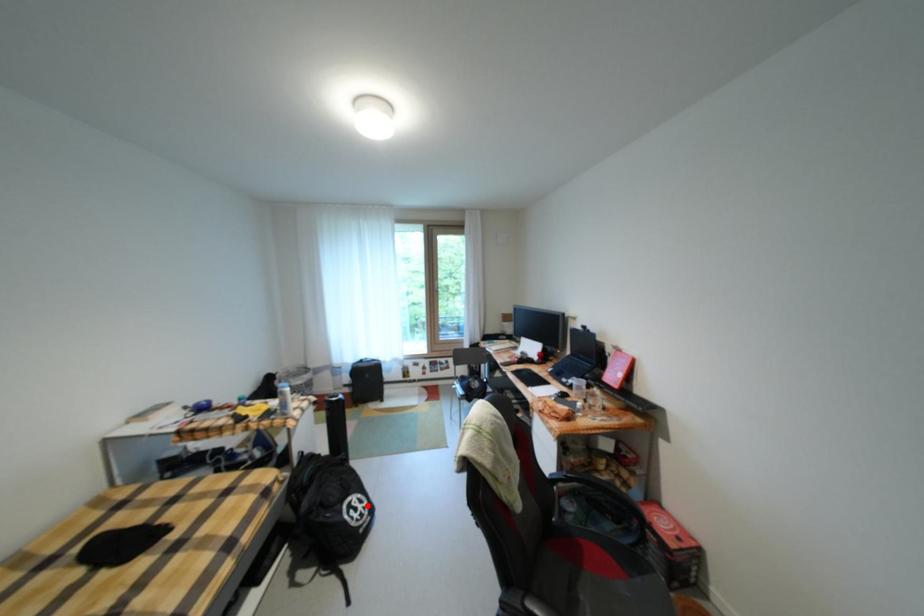
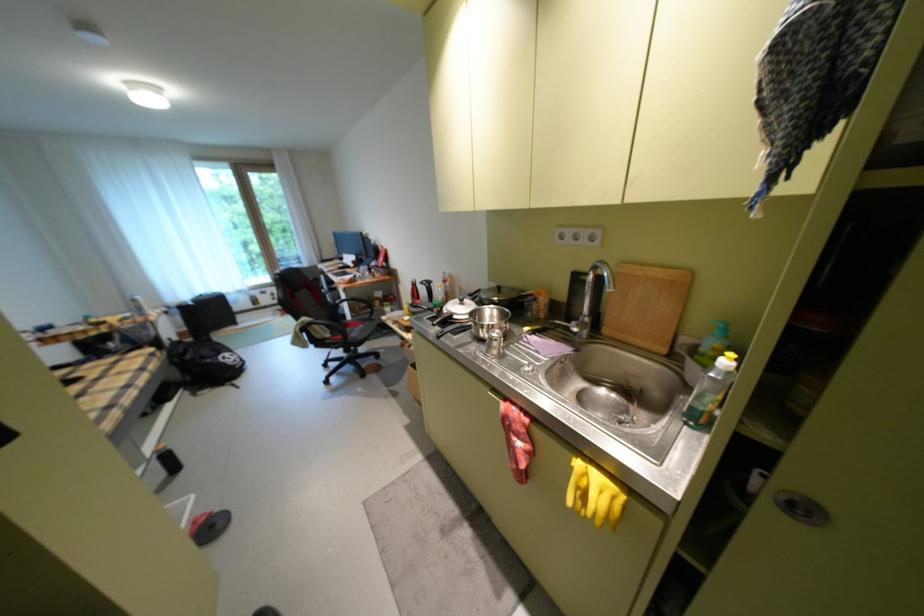
Find the pixel in the second image that matches the highlighted location in the first image.

(239, 358)